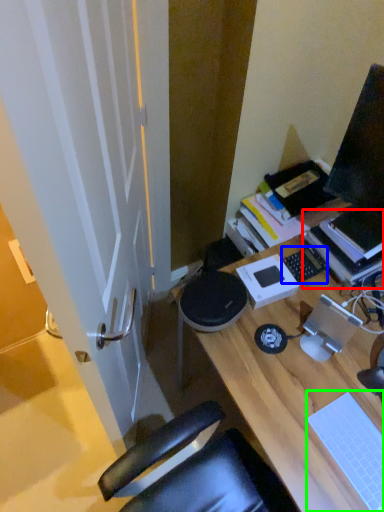
Question: Estimate the real-world distances between objects in this image. Which object is closer to book (highlighted by a red box), laptop keyboard (highlighted by a blue box) or laptop keyboard (highlighted by a green box)?

Choices:
 (A) laptop keyboard
 (B) laptop keyboard

Answer: (A)